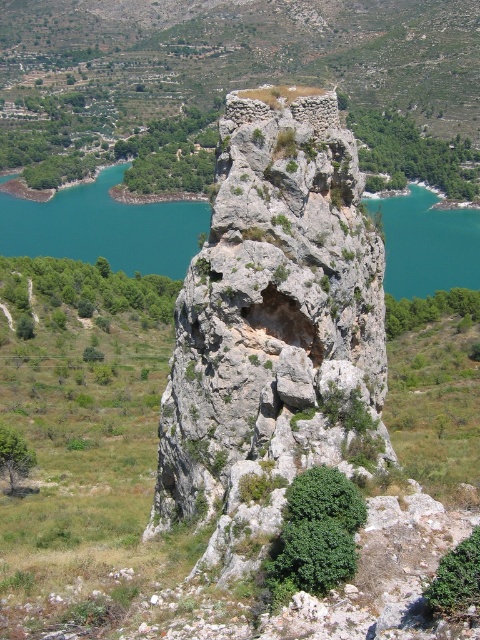
Question: Does green leafy shrubs at lower left appear on the right side of green leafy shrubs at upper right?

Choices:
 (A) yes
 (B) no

Answer: (B)

Question: Which point is closer to the camera taking this photo?

Choices:
 (A) (462, 588)
 (B) (322, 452)

Answer: (A)

Question: Which of these objects is positioned closest to the green leafy shrubs at center right?

Choices:
 (A) gray rough rock at center
 (B) green leafy shrubs at upper right

Answer: (A)

Question: Is gray rough rock at center thinner than green leafy bush at lower right?

Choices:
 (A) yes
 (B) no

Answer: (B)

Question: Considering the relative positions of gray rough rock at center and green leafy bush at lower right in the image provided, where is gray rough rock at center located with respect to green leafy bush at lower right?

Choices:
 (A) above
 (B) below

Answer: (A)

Question: Which point is closer to the camera taking this photo?

Choices:
 (A) (340, 332)
 (B) (88, 282)
 (C) (459, 611)

Answer: (C)